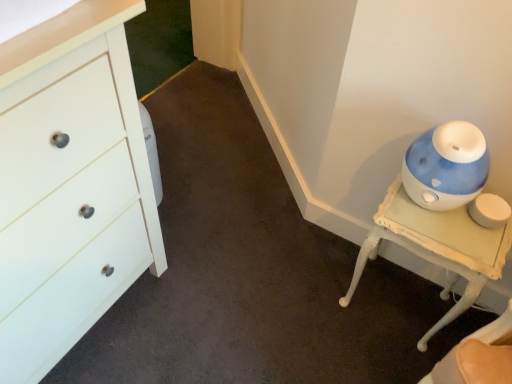
I want to click on vacant location below blue glossy humidifier at right (from a real-world perspective), so click(391, 300).